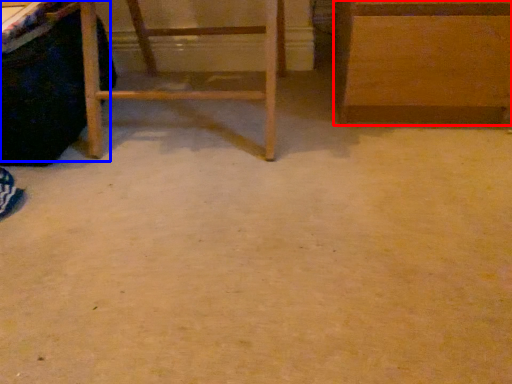
Question: Which of the following is the farthest to the observer, furniture (highlighted by a red box) or vanity (highlighted by a blue box)?

Choices:
 (A) furniture
 (B) vanity

Answer: (A)